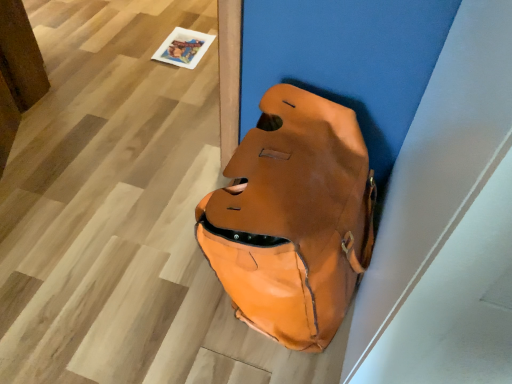
Locate an element on the screen. leather backpack at lower right is located at coordinates (293, 219).

Describe the element at coordinates (293, 219) in the screenshot. I see `leather backpack at lower right` at that location.

The height and width of the screenshot is (384, 512). I want to click on leather backpack at lower right, so click(x=293, y=219).